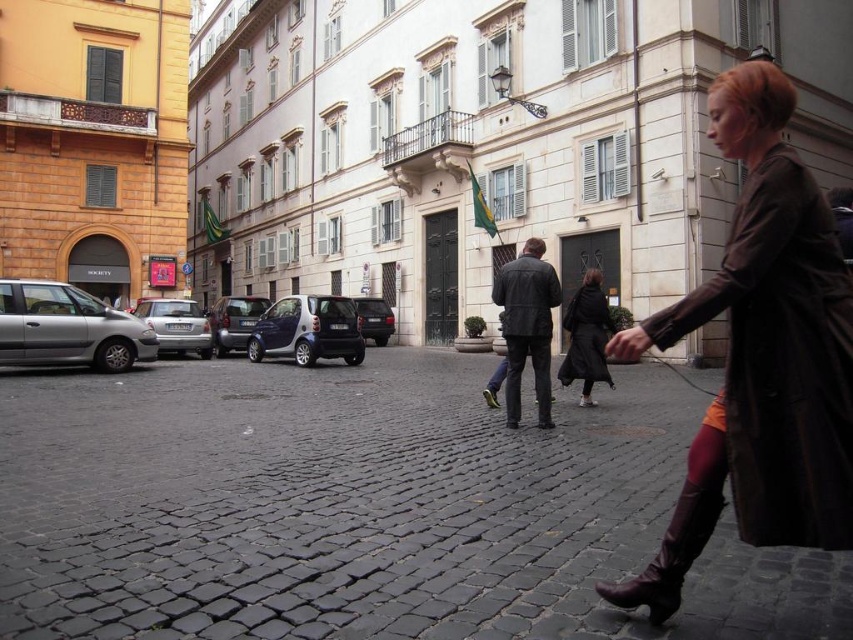
You are a photographer trying to capture both the metallic blue car at center and the brown matte hair at center in a single frame. Which object will appear larger in your photo?

The metallic blue car at center will appear larger in the photo since it is bigger than the brown matte hair at center.

In the scene shown: You are standing on the cobblestone street in the scene and see the dark brown leather jacket at center. If you want to walk directly towards it, which direction should you move?

The dark brown leather jacket at center is located at point 0.516 on the x and 0.618 on the y coordinate. Since you are on the cobblestone street in the foreground, you would need to move forward towards the center of the image to reach it.